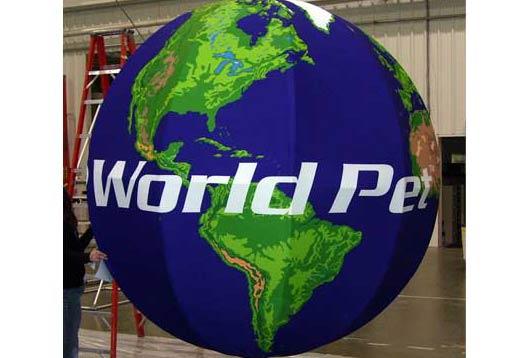
At what (x,y) coordinates should I click in order to perform the action: click on doorway. Please return your answer as a coordinate pair (x, y). Image resolution: width=525 pixels, height=358 pixels. Looking at the image, I should click on (439, 243), (438, 135), (464, 135).